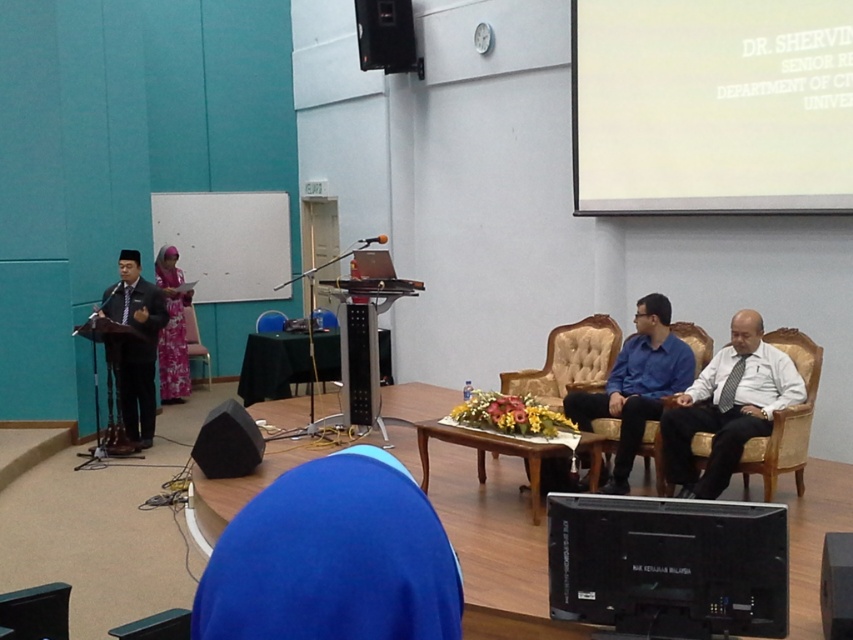
From the picture: You are an event organizer who needs to place a new microphone stand between the black plastic speaker at upper center and the black wood speaker at lower right. Based on their positions, which speaker should the stand be closer to?

The black plastic speaker at upper center is closer to the viewer, so the microphone stand should be placed closer to the black plastic speaker at upper center to maintain proximity and ensure the speaker can easily reach it.

You are attending a formal event and want to place a small gift on the blue fabric at lower center. If your arm reaches out 3 feet, can you place the gift without moving closer?

The blue fabric at lower center is 3.89 feet away from the camera. Since your arm reaches 3 feet, you cannot reach it without moving closer.